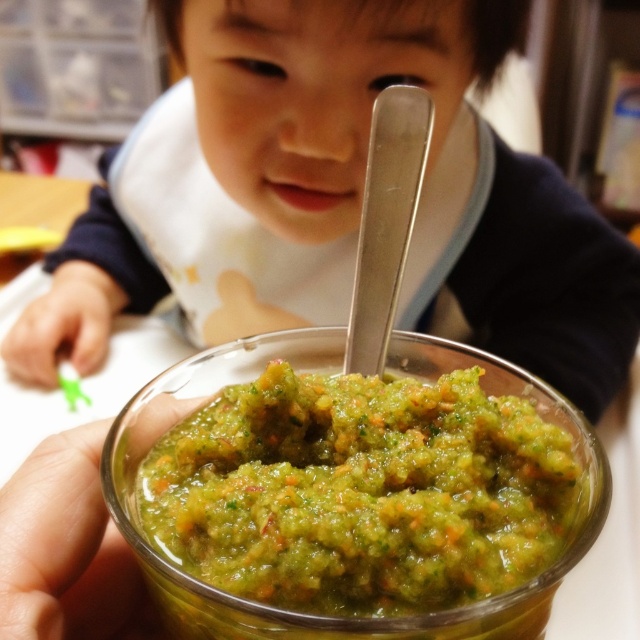
Between matte white bib at upper center and green paste at center, which one is positioned higher?

matte white bib at upper center

Is matte white bib at upper center positioned before green paste at center?

No, matte white bib at upper center is behind green paste at center.

Measure the distance between matte white bib at upper center and camera.

matte white bib at upper center is 40.65 centimeters away from camera.

This screenshot has height=640, width=640. Find the location of `matte white bib at upper center`. matte white bib at upper center is located at coordinates (321, 92).

Can you confirm if matte white bib at upper center is wider than shiny silver spoon at center?

Indeed, matte white bib at upper center has a greater width compared to shiny silver spoon at center.

Between point (164, 19) and point (355, 291), which one is positioned in front?

Point (355, 291) is in front.

Locate an element on the screen. This screenshot has width=640, height=640. matte white bib at upper center is located at coordinates (321, 92).

Can you confirm if green paste at center is wider than shiny silver spoon at center?

Yes.

Is point (336, 582) positioned in front of point (376, 355)?

Yes, it is.

The height and width of the screenshot is (640, 640). Describe the element at coordinates (362, 492) in the screenshot. I see `green paste at center` at that location.

The height and width of the screenshot is (640, 640). I want to click on green paste at center, so click(362, 492).